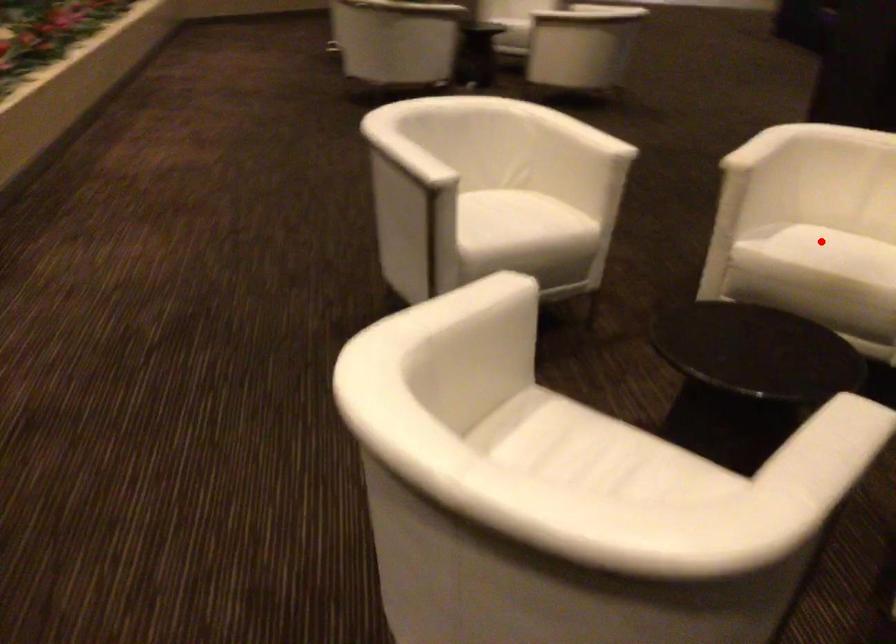
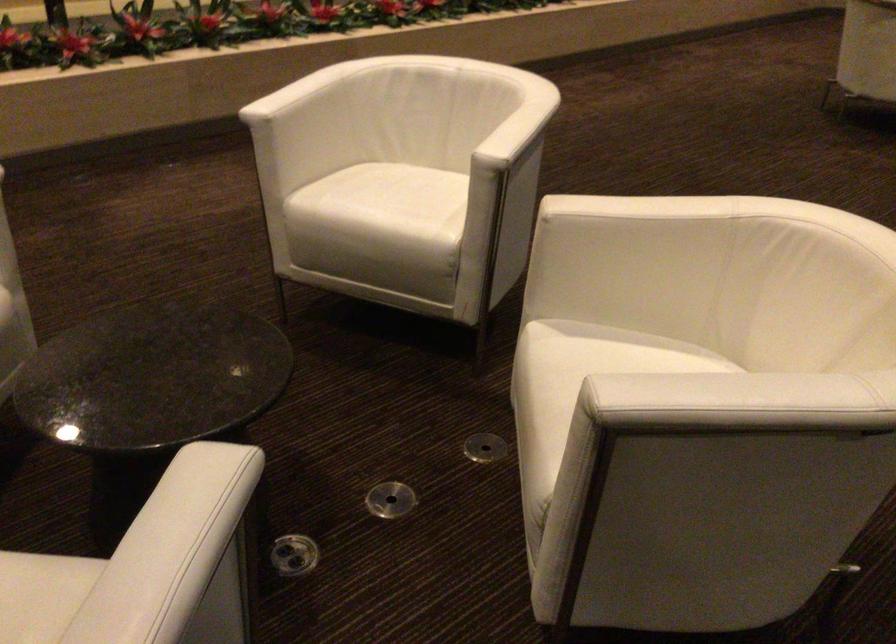
Question: I am providing you with two images of the same scene from different viewpoints. In image1, a red point is highlighted. Considering the same 3D point in image2, which of the following is correct?

Choices:
 (A) It is closer
 (B) It is farther

Answer: (A)